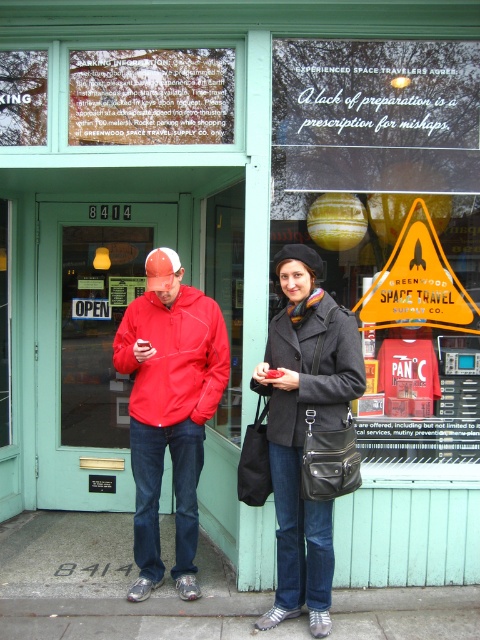
You are standing in front of the teal storefront and want to determine which of the two points, point (166,268) or point (147,365), is closer to you. Based on the scene description, which point is nearer?

Point (166,268) is closer to the viewer than point (147,365).

You are a tailor who needs to determine which coat requires more fabric to alter. Based on the image, which coat between the red fleece jacket at center and the matte black coat at center would need more fabric due to its size?

The red fleece jacket at center requires more fabric because it is larger in size than the matte black coat at center.